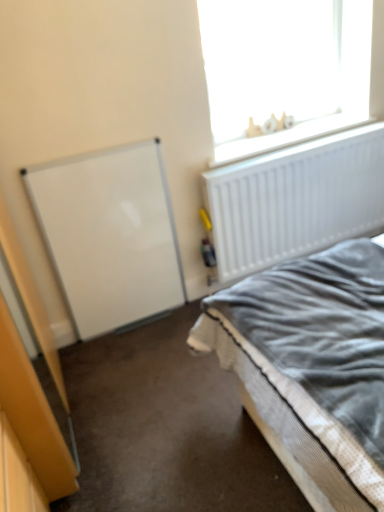
Question: Is white plastic letters at upper right thinner than textured gray bed at lower right?

Choices:
 (A) yes
 (B) no

Answer: (A)

Question: Are white plastic letters at upper right and textured gray bed at lower right located far from each other?

Choices:
 (A) yes
 (B) no

Answer: (A)

Question: Does white plastic letters at upper right lie in front of textured gray bed at lower right?

Choices:
 (A) yes
 (B) no

Answer: (B)

Question: Could you tell me if white plastic letters at upper right is turned towards textured gray bed at lower right?

Choices:
 (A) no
 (B) yes

Answer: (A)

Question: Is white plastic letters at upper right behind textured gray bed at lower right?

Choices:
 (A) yes
 (B) no

Answer: (A)

Question: Is white plastic letters at upper right shorter than textured gray bed at lower right?

Choices:
 (A) no
 (B) yes

Answer: (A)

Question: Could you tell me if white matte love sign at upper right is facing textured gray bed at lower right?

Choices:
 (A) no
 (B) yes

Answer: (A)

Question: Does white matte love sign at upper right have a lesser width compared to textured gray bed at lower right?

Choices:
 (A) yes
 (B) no

Answer: (A)

Question: Is textured gray bed at lower right at the back of white matte love sign at upper right?

Choices:
 (A) yes
 (B) no

Answer: (B)

Question: Is white matte love sign at upper right closer to camera compared to textured gray bed at lower right?

Choices:
 (A) no
 (B) yes

Answer: (A)

Question: Considering the relative sizes of white matte love sign at upper right and textured gray bed at lower right in the image provided, is white matte love sign at upper right taller than textured gray bed at lower right?

Choices:
 (A) yes
 (B) no

Answer: (A)

Question: From a real-world perspective, is white matte love sign at upper right beneath textured gray bed at lower right?

Choices:
 (A) yes
 (B) no

Answer: (B)

Question: Is textured gray bed at lower right facing away from white plastic letters at upper right?

Choices:
 (A) yes
 (B) no

Answer: (B)